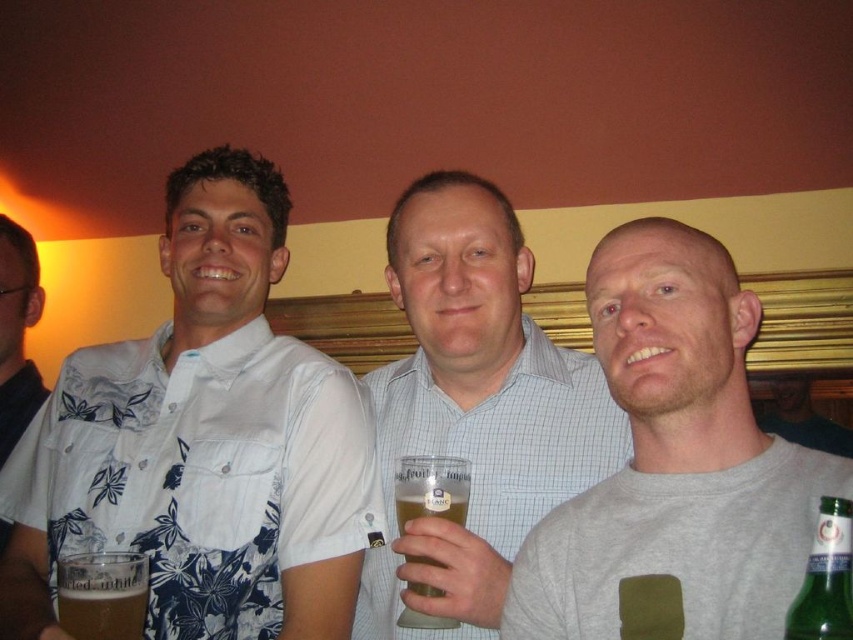
Consider the image. Is checkered fabric shirt at center smaller than white floral shirt at left?

Incorrect, checkered fabric shirt at center is not smaller in size than white floral shirt at left.

Which of these two, checkered fabric shirt at center or white floral shirt at left, stands shorter?

Standing shorter between the two is white floral shirt at left.

Is point (502, 448) farther from viewer compared to point (16, 362)?

No, it is in front of (16, 362).

At what (x,y) coordinates should I click in order to perform the action: click on checkered fabric shirt at center. Please return your answer as a coordinate pair (x, y). Looking at the image, I should click on (474, 406).

Looking at this image, does gray matte t-shirt at center appear on the right side of checkered fabric shirt at center?

Correct, you'll find gray matte t-shirt at center to the right of checkered fabric shirt at center.

Does gray matte t-shirt at center have a greater width compared to checkered fabric shirt at center?

No.

Between point (653, 406) and point (486, 593), which one is positioned behind?

Positioned behind is point (486, 593).

Locate an element on the screen. gray matte t-shirt at center is located at coordinates (675, 465).

Which of these two, green glass bottle at lower right or translucent glass mug at center, stands taller?

With more height is translucent glass mug at center.

Can you confirm if green glass bottle at lower right is positioned to the left of translucent glass mug at center?

In fact, green glass bottle at lower right is to the right of translucent glass mug at center.

The height and width of the screenshot is (640, 853). What do you see at coordinates (825, 577) in the screenshot?
I see `green glass bottle at lower right` at bounding box center [825, 577].

The width and height of the screenshot is (853, 640). In order to click on green glass bottle at lower right in this screenshot , I will do `click(825, 577)`.